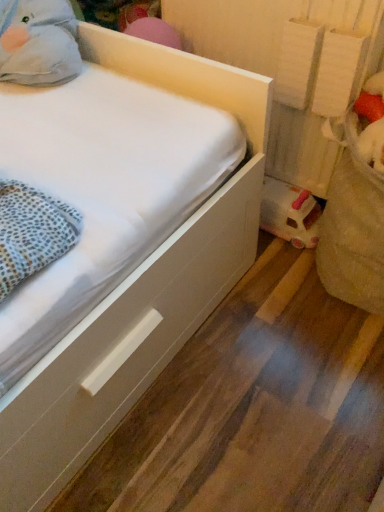
Looking at this image, what is the approximate width of white matte bed at center?

It is 28.84 inches.

You are a GUI agent. You are given a task and a screenshot of the screen. Output one action in this format:
    pyautogui.click(x=<x>, y=<y>)
    Task: Click on the white matte bed at center
    
    Given the screenshot: What is the action you would take?
    pos(136,289)

Describe the element at coordinates (136, 289) in the screenshot. I see `white matte bed at center` at that location.

I want to click on white matte bed at center, so click(136, 289).